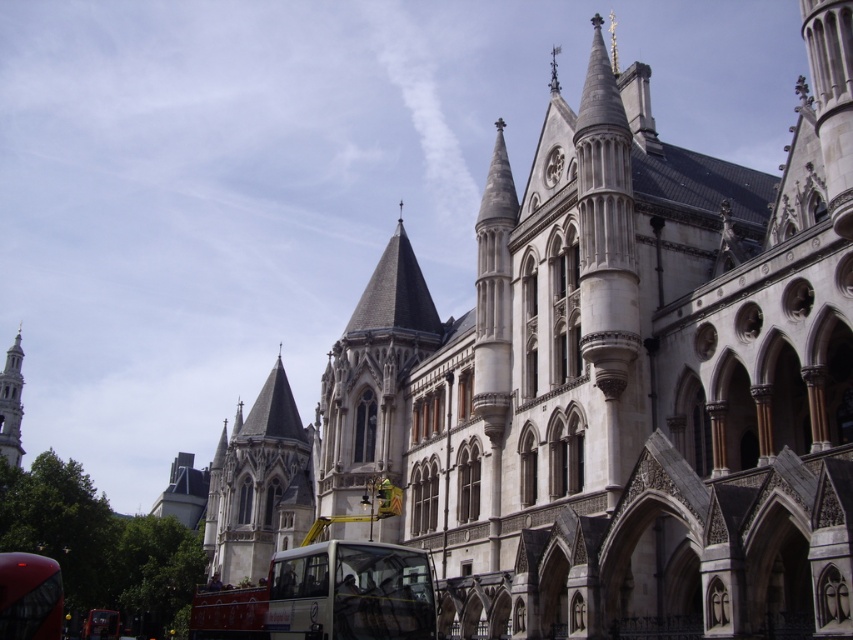
You are a tourist standing in front of the historic building and want to take a photo that includes both the shiny red bus at lower left and the silver metallic spire at left. Which object should you focus on first to ensure both are in the frame?

You should focus on the shiny red bus at lower left first because it is smaller than the silver metallic spire at left, so you need to position it carefully to include both in the frame.